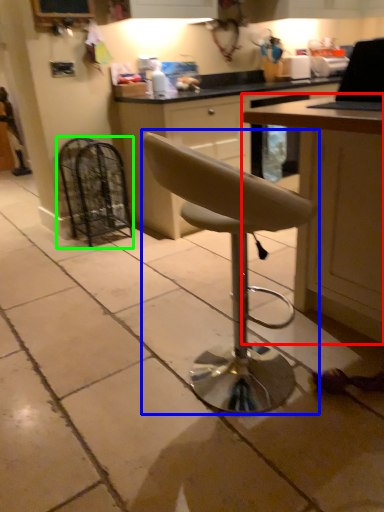
Question: Based on their relative distances, which object is nearer to table (highlighted by a red box)? Choose from chair (highlighted by a blue box) and appliance (highlighted by a green box).

Choices:
 (A) chair
 (B) appliance

Answer: (A)